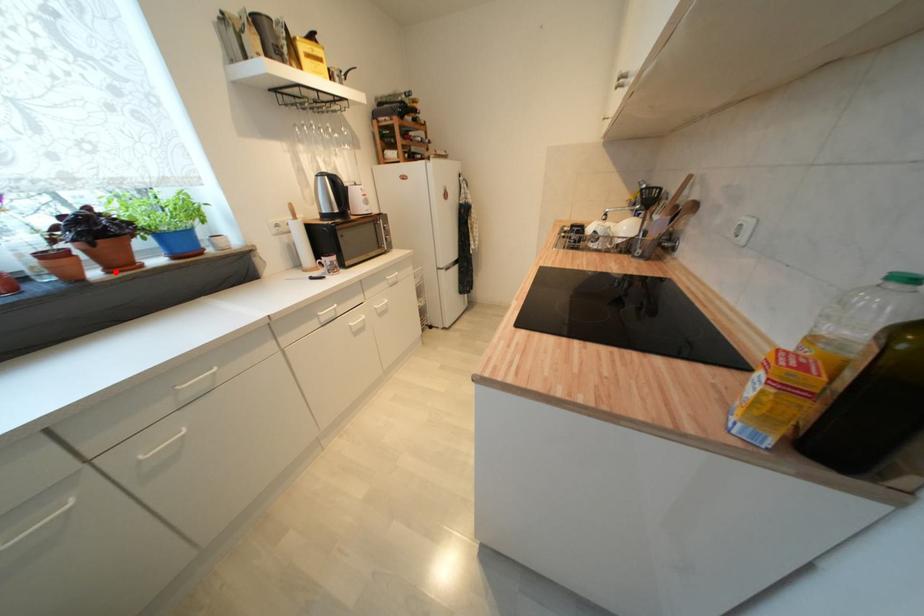
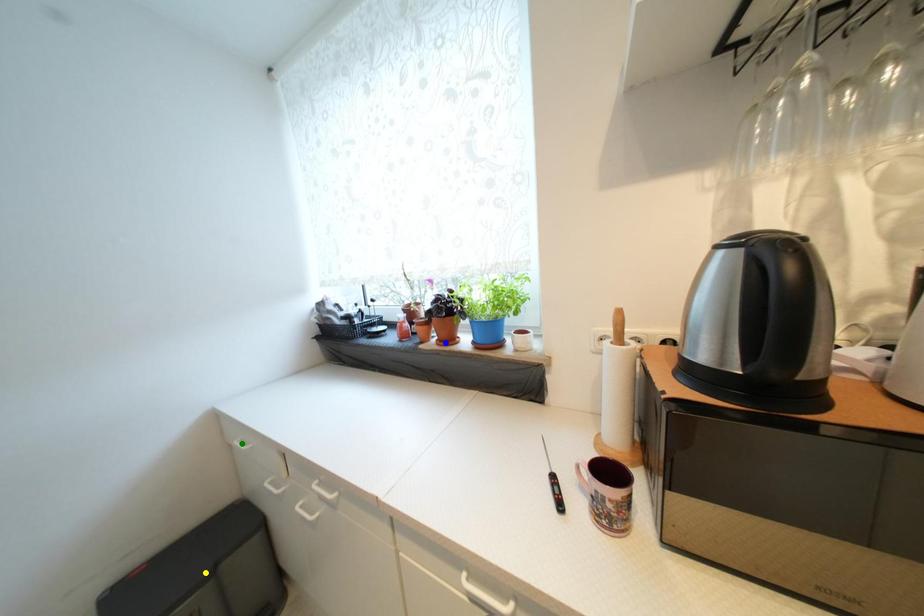
Question: I am providing you with two images of the same scene from different viewpoints. A red point is marked on the first image. You are given multiple points on the second image. Which point in image 2 is actually the same real-world point as the red point in image 1?

Choices:
 (A) blue point
 (B) green point
 (C) yellow point

Answer: (A)